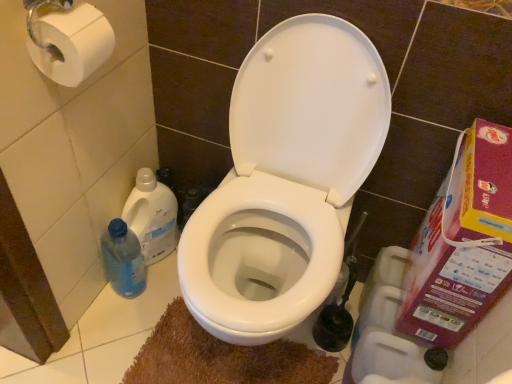
In order to click on free space above plastic cardboard box at right (from a real-world perspective) in this screenshot , I will do `click(495, 159)`.